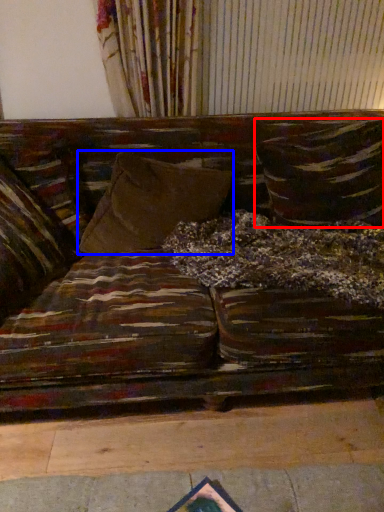
Question: Among these objects, which one is farthest to the camera, pillow (highlighted by a red box) or pillow (highlighted by a blue box)?

Choices:
 (A) pillow
 (B) pillow

Answer: (A)